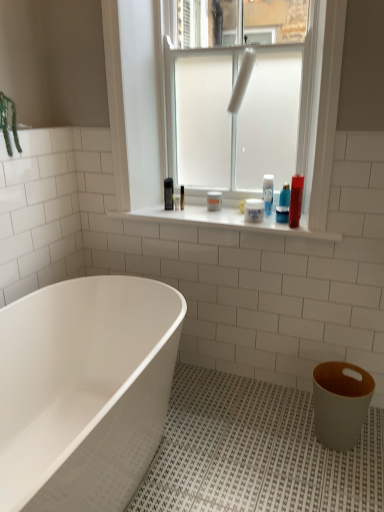
You are a GUI agent. You are given a task and a screenshot of the screen. Output one action in this format:
    pyautogui.click(x=<x>, y=<y>)
    Task: Click on the free space to the left of white matte jar at center, the 2th toiletry when ordered from right to left
    
    Given the screenshot: What is the action you would take?
    pyautogui.click(x=231, y=216)